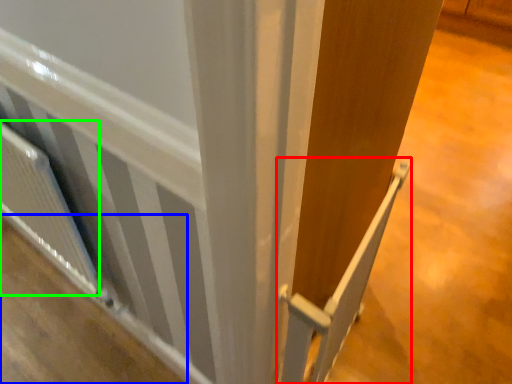
Question: Which object is positioned closest to rail (highlighted by a red box)? Select from plywood (highlighted by a blue box) and radiator (highlighted by a green box).

Choices:
 (A) plywood
 (B) radiator

Answer: (B)